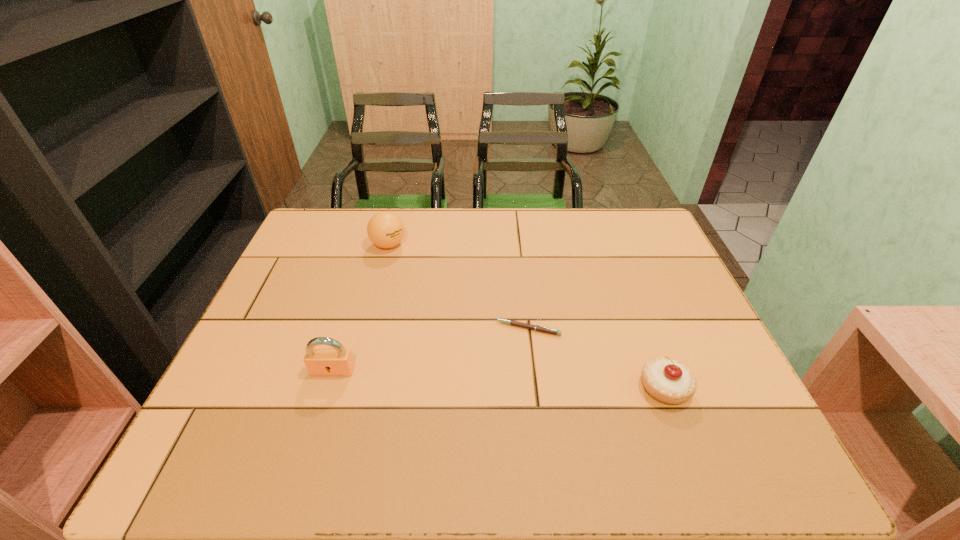
Identify the location of free region located 0.390m at the nib of the pen. The image size is (960, 540). (364, 427).

Locate an element on the screen. The height and width of the screenshot is (540, 960). free region located on the side with brand of the ping-pong ball is located at coordinates (406, 283).

Image resolution: width=960 pixels, height=540 pixels. Identify the location of vacant space situated 0.150m on the side with brand of the ping-pong ball. (407, 285).

Find the location of `free spot located 0.060m on the side with brand of the ping-pong ball`. free spot located 0.060m on the side with brand of the ping-pong ball is located at coordinates (398, 266).

Find the location of a particular element. This screenshot has width=960, height=540. object that is positioned at the far edge is located at coordinates [x=385, y=229].

Identify the location of object present at the near edge. The width and height of the screenshot is (960, 540). (669, 381).

Image resolution: width=960 pixels, height=540 pixels. Find the location of `object that is at the right edge`. object that is at the right edge is located at coordinates (669, 381).

Where is `object positioned at the near right corner`? This screenshot has width=960, height=540. object positioned at the near right corner is located at coordinates (669, 381).

Where is `vacant region at the far edge of the desktop`? vacant region at the far edge of the desktop is located at coordinates (518, 247).

This screenshot has height=540, width=960. In the image, there is a desktop. What are the coordinates of `free region at the near edge` in the screenshot? It's located at click(x=454, y=394).